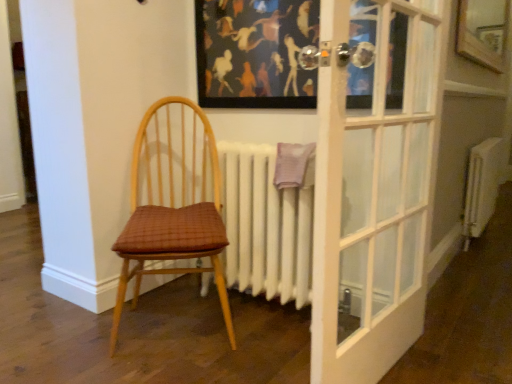
What are the coordinates of `vacant area that lies to the right of wooden chair with woven seat cushion at left` in the screenshot? It's located at (263, 342).